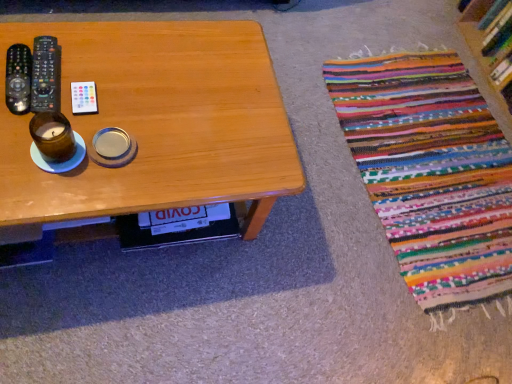
The height and width of the screenshot is (384, 512). What are the coordinates of `free space in front of white plastic remote control at upper left, the third remote control when ordered from left to right` in the screenshot? It's located at (50, 164).